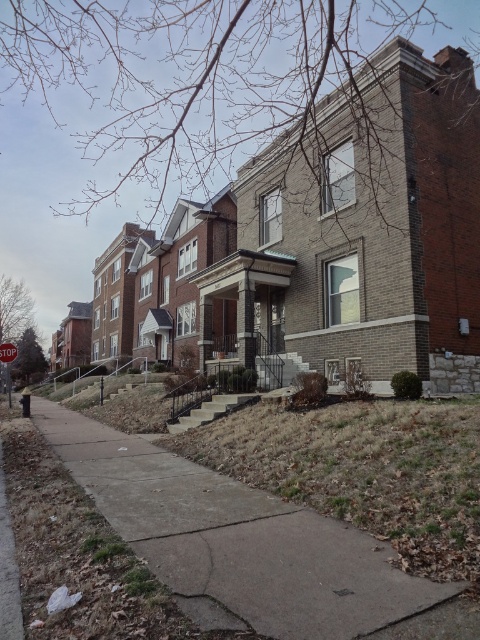
In the scene shown: You are a delivery person approaching the sidewalk in the image. You need to place a heavy package on the ground near the red stop sign at top. Can you confirm if the concrete at lower left is a suitable location for placing the package?

The concrete at lower left is in front of the red stop sign at top, so placing the package there would position it closer to the stop sign. However, since the concrete is at the lower left, it might be located away from the stop sign. Please ensure the package is placed near the stop sign itself.

You are a delivery person trying to navigate through the sidewalk in the residential area. You need to know if the concrete at lower left is taller than the red stop sign at top to avoid obstacles. Can you confirm?

The concrete at lower left is shorter than the red stop sign at top, so it is not taller. Therefore, the concrete at lower left is shorter and will not obstruct your path as much as the red stop sign at top.